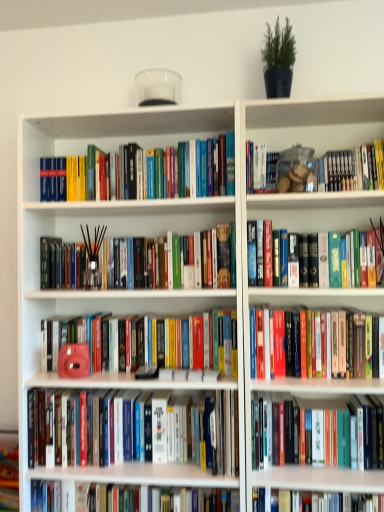
Question: Considering the relative positions of matte pink camera at center, the 5th book viewed from the top, and hardcover book at center, the second book in the top-to-bottom sequence, in the image provided, is matte pink camera at center, the 5th book viewed from the top, to the left of hardcover book at center, the second book in the top-to-bottom sequence, from the viewer's perspective?

Choices:
 (A) no
 (B) yes

Answer: (B)

Question: From a real-world perspective, does matte pink camera at center, which is the 4th book in bottom-to-top order, sit lower than hardcover book at center, the second book in the top-to-bottom sequence?

Choices:
 (A) yes
 (B) no

Answer: (A)

Question: Is matte pink camera at center, which is the 4th book in bottom-to-top order, outside hardcover book at center, marked as the 7th book in a bottom-to-top arrangement?

Choices:
 (A) no
 (B) yes

Answer: (B)

Question: Is the depth of matte pink camera at center, which is the 4th book in bottom-to-top order, greater than that of hardcover book at center, marked as the 7th book in a bottom-to-top arrangement?

Choices:
 (A) no
 (B) yes

Answer: (B)

Question: Is matte pink camera at center, which is the 4th book in bottom-to-top order, shorter than hardcover book at center, marked as the 7th book in a bottom-to-top arrangement?

Choices:
 (A) no
 (B) yes

Answer: (B)

Question: Looking at their shapes, would you say white glossy book at center, which is the 8th book in top-to-bottom order, is wider or thinner than hardcover books at center, which ranks as the 5th book in bottom-to-top order?

Choices:
 (A) wide
 (B) thin

Answer: (A)

Question: Is point (117, 505) positioned closer to the camera than point (311, 351)?

Choices:
 (A) farther
 (B) closer

Answer: (A)

Question: In the image, is white glossy book at center, which is the first book in bottom-to-top order, positioned in front of or behind hardcover books at center, the fourth book when ordered from top to bottom?

Choices:
 (A) behind
 (B) front

Answer: (A)

Question: From their relative heights in the image, would you say white glossy book at center, which is the first book in bottom-to-top order, is taller or shorter than hardcover books at center, which ranks as the 5th book in bottom-to-top order?

Choices:
 (A) tall
 (B) short

Answer: (A)

Question: In the image, is white glossy book at center, which is the 8th book in top-to-bottom order, positioned in front of or behind hardcover book at center, the second book in the top-to-bottom sequence?

Choices:
 (A) behind
 (B) front

Answer: (A)

Question: In terms of size, does white glossy book at center, which is the 8th book in top-to-bottom order, appear bigger or smaller than hardcover book at center, the second book in the top-to-bottom sequence?

Choices:
 (A) small
 (B) big

Answer: (B)

Question: Does point (223, 492) appear closer or farther from the camera than point (344, 245)?

Choices:
 (A) farther
 (B) closer

Answer: (B)

Question: Based on their positions, is white glossy book at center, which is the first book in bottom-to-top order, located to the left or right of hardcover book at center, the second book in the top-to-bottom sequence?

Choices:
 (A) left
 (B) right

Answer: (A)

Question: From the image's perspective, is hardcover book at center, positioned as the 2th book in bottom-to-top order, located above or below matte pink camera at center, acting as the 6th book starting from the top?

Choices:
 (A) above
 (B) below

Answer: (B)

Question: Is point (302, 431) closer or farther from the camera than point (188, 454)?

Choices:
 (A) farther
 (B) closer

Answer: (B)